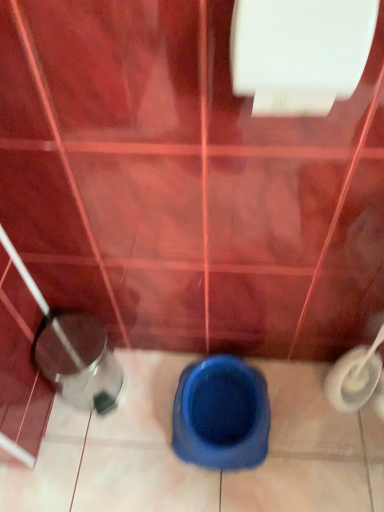
This screenshot has width=384, height=512. Describe the element at coordinates (299, 52) in the screenshot. I see `white glossy toilet paper at upper center` at that location.

You are a GUI agent. You are given a task and a screenshot of the screen. Output one action in this format:
    pyautogui.click(x=<x>, y=<y>)
    Task: Click on the white glossy toilet paper at upper center
    
    Given the screenshot: What is the action you would take?
    pyautogui.click(x=299, y=52)

Measure the distance between blue rubber toilet at center and shiny metallic potty at lower left.

They are 11.53 inches apart.

From a real-world perspective, who is located lower, blue rubber toilet at center or shiny metallic potty at lower left?

blue rubber toilet at center, from a real-world perspective.

Can you confirm if blue rubber toilet at center is wider than shiny metallic potty at lower left?

Yes.

Image resolution: width=384 pixels, height=512 pixels. I want to click on toilet that is under the shiny metallic potty at lower left (from a real-world perspective), so pyautogui.click(x=221, y=414).

Would you say shiny metallic potty at lower left is inside or outside white glossy toilet paper at upper center?

The correct answer is: outside.

Which of these two, shiny metallic potty at lower left or white glossy toilet paper at upper center, stands shorter?

white glossy toilet paper at upper center.

Is shiny metallic potty at lower left next to white glossy toilet paper at upper center and touching it?

No, shiny metallic potty at lower left is not with white glossy toilet paper at upper center.

I want to click on toilet paper located above the blue rubber toilet at center (from the image's perspective), so click(x=299, y=52).

Consider the image. Can you confirm if blue rubber toilet at center is bigger than white glossy toilet paper at upper center?

Yes.

Between blue rubber toilet at center and white glossy toilet paper at upper center, which one has less height?

Standing shorter between the two is blue rubber toilet at center.

Is blue rubber toilet at center next to white glossy toilet paper at upper center?

blue rubber toilet at center and white glossy toilet paper at upper center are not in contact.

Does shiny metallic potty at lower left have a greater width compared to blue rubber toilet at center?

No.

How many degrees apart are the facing directions of shiny metallic potty at lower left and blue rubber toilet at center?

0.00128 degrees separate the facing orientations of shiny metallic potty at lower left and blue rubber toilet at center.

Would you consider shiny metallic potty at lower left to be distant from blue rubber toilet at center?

No, shiny metallic potty at lower left is in close proximity to blue rubber toilet at center.

From the image's perspective, which is below, shiny metallic potty at lower left or blue rubber toilet at center?

blue rubber toilet at center.

Considering the relative sizes of white glossy toilet paper at upper center and blue rubber toilet at center in the image provided, is white glossy toilet paper at upper center wider than blue rubber toilet at center?

No, white glossy toilet paper at upper center is not wider than blue rubber toilet at center.

Does point (341, 37) lie behind point (216, 360)?

No.

Is white glossy toilet paper at upper center far from blue rubber toilet at center?

No, white glossy toilet paper at upper center is not far away from blue rubber toilet at center.

I want to click on potty below the white glossy toilet paper at upper center (from the image's perspective), so click(x=78, y=361).

Is white glossy toilet paper at upper center not near shiny metallic potty at lower left?

white glossy toilet paper at upper center is near shiny metallic potty at lower left, not far away.

From the image's perspective, between white glossy toilet paper at upper center and shiny metallic potty at lower left, who is located below?

shiny metallic potty at lower left.

Is point (233, 14) in front of point (66, 349)?

Yes, point (233, 14) is closer to viewer.

Where is `potty to the left of blue rubber toilet at center`? potty to the left of blue rubber toilet at center is located at coordinates (78, 361).

I want to click on toilet paper that is on the right side of shiny metallic potty at lower left, so click(x=299, y=52).

When comparing their distances from blue rubber toilet at center, does shiny metallic potty at lower left or white glossy toilet paper at upper center seem further?

white glossy toilet paper at upper center lies further to blue rubber toilet at center than the other object.

Based on their spatial positions, is white glossy toilet paper at upper center or shiny metallic potty at lower left closer to blue rubber toilet at center?

The object closer to blue rubber toilet at center is shiny metallic potty at lower left.

Considering their positions, is blue rubber toilet at center positioned further to shiny metallic potty at lower left than white glossy toilet paper at upper center?

white glossy toilet paper at upper center lies further to shiny metallic potty at lower left than the other object.

From the image, which object appears to be farther from shiny metallic potty at lower left, white glossy toilet paper at upper center or blue rubber toilet at center?

white glossy toilet paper at upper center is further to shiny metallic potty at lower left.

When comparing their distances from white glossy toilet paper at upper center, does shiny metallic potty at lower left or blue rubber toilet at center seem closer?

shiny metallic potty at lower left is positioned closer to the anchor white glossy toilet paper at upper center.

Based on their spatial positions, is blue rubber toilet at center or shiny metallic potty at lower left further from white glossy toilet paper at upper center?

blue rubber toilet at center is positioned further to the anchor white glossy toilet paper at upper center.

You are a GUI agent. You are given a task and a screenshot of the screen. Output one action in this format:
    pyautogui.click(x=<x>, y=<y>)
    Task: Click on the toilet located between white glossy toilet paper at upper center and shiny metallic potty at lower left in the depth direction
    The image size is (384, 512).
    Given the screenshot: What is the action you would take?
    pyautogui.click(x=221, y=414)